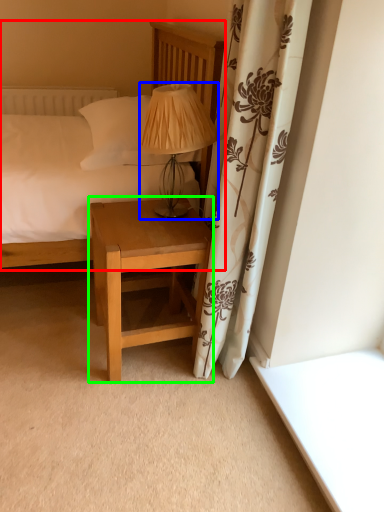
Question: Which is nearer to the bed (highlighted by a red box)? table lamp (highlighted by a blue box) or nightstand (highlighted by a green box).

Choices:
 (A) table lamp
 (B) nightstand

Answer: (A)